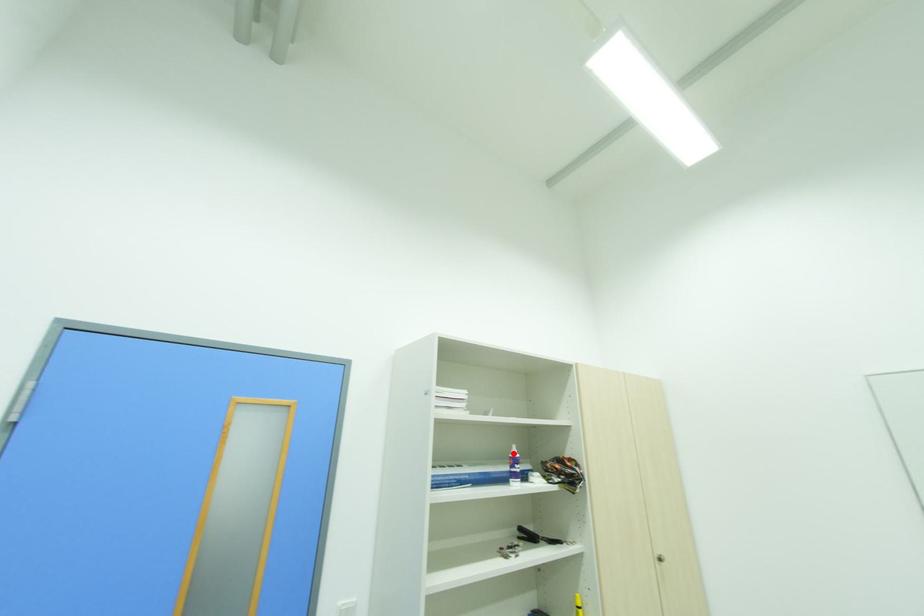
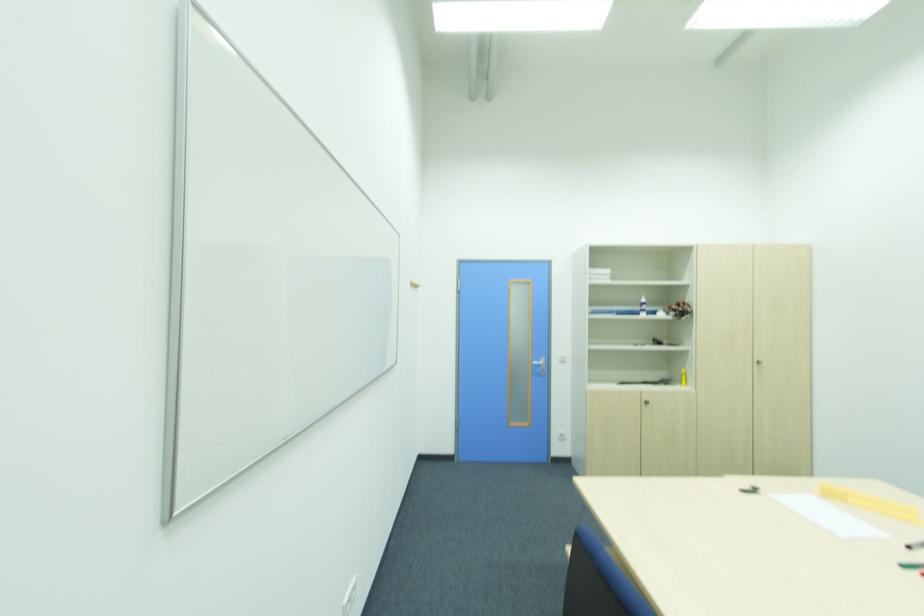
Where in the second image is the point corresponding to the highlighted location from the first image?

(643, 301)